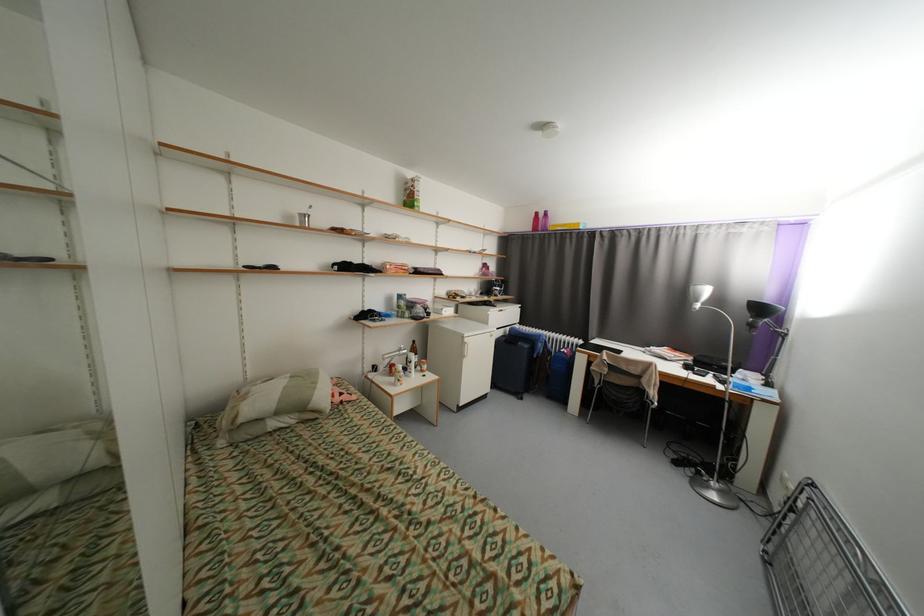
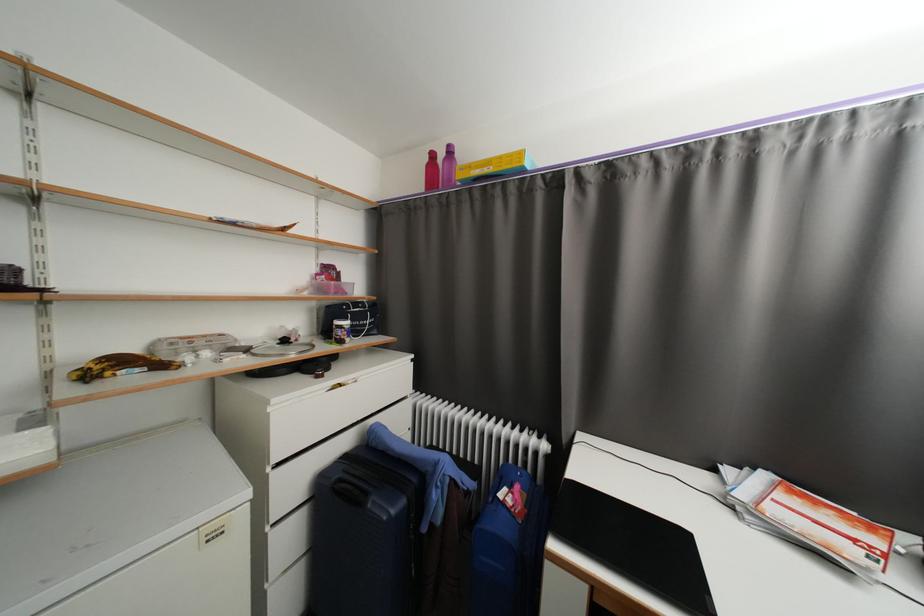
Find the pixel in the second image that matches point 488,294 in the first image.

(290, 342)